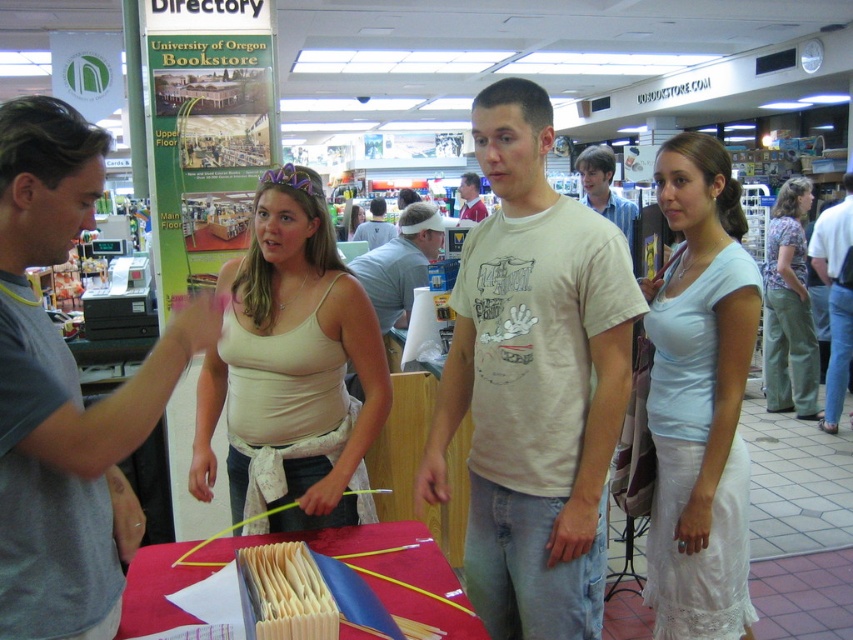
You are a customer in the University of Oregon Bookstore and see two items at the center of the table covered with a red cloth. The items are the light blue cotton dress at center and jeans at center. Which one is positioned more to the left?

The light blue cotton dress at center is positioned more to the left than the jeans at center.